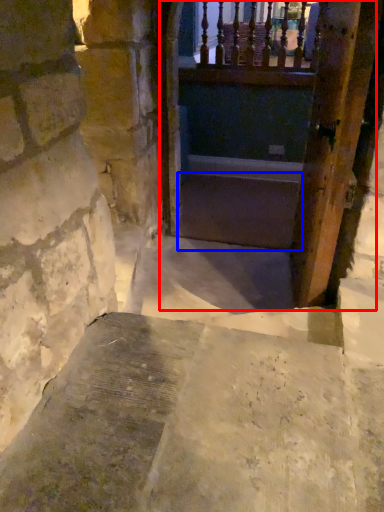
Question: Among these objects, which one is nearest to the camera, tunnel (highlighted by a red box) or stairs (highlighted by a blue box)?

Choices:
 (A) tunnel
 (B) stairs

Answer: (A)